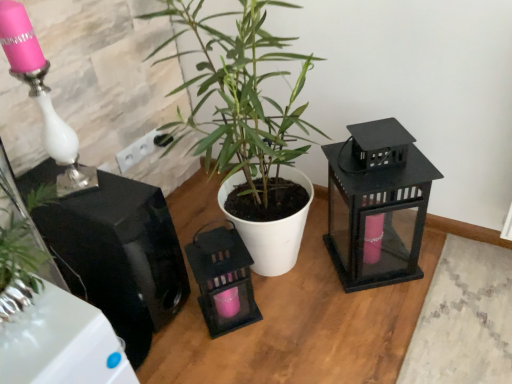
Question: Is glossy black speaker at left, which is the 1th appliance in left-to-right order, aimed at matte black lantern at right, acting as the 2th appliance starting from the left?

Choices:
 (A) no
 (B) yes

Answer: (A)

Question: Does glossy black speaker at left, which ranks as the 2th appliance in right-to-left order, contain matte black lantern at right, acting as the 2th appliance starting from the left?

Choices:
 (A) no
 (B) yes

Answer: (A)

Question: Is glossy black speaker at left, which ranks as the 2th appliance in right-to-left order, outside of matte black lantern at right, acting as the 2th appliance starting from the left?

Choices:
 (A) yes
 (B) no

Answer: (A)

Question: Is glossy black speaker at left, which is the 1th appliance in left-to-right order, placed right next to matte black lantern at right, acting as the 2th appliance starting from the left?

Choices:
 (A) no
 (B) yes

Answer: (A)

Question: Is glossy black speaker at left, which ranks as the 2th appliance in right-to-left order, in front of matte black lantern at right, acting as the 2th appliance starting from the left?

Choices:
 (A) yes
 (B) no

Answer: (A)

Question: Is pink glass table lamp at left wider or thinner than glossy black speaker at left, which is the 1th appliance in left-to-right order?

Choices:
 (A) wide
 (B) thin

Answer: (B)

Question: From a real-world perspective, relative to glossy black speaker at left, which is the 1th appliance in left-to-right order, is pink glass table lamp at left vertically above or below?

Choices:
 (A) above
 (B) below

Answer: (A)

Question: From the image's perspective, relative to glossy black speaker at left, which is the 1th appliance in left-to-right order, is pink glass table lamp at left above or below?

Choices:
 (A) above
 (B) below

Answer: (A)

Question: Is pink glass table lamp at left inside or outside of glossy black speaker at left, which is the 1th appliance in left-to-right order?

Choices:
 (A) inside
 (B) outside

Answer: (B)

Question: From the image's perspective, is pink glass table lamp at left above or below green matte plant at center?

Choices:
 (A) above
 (B) below

Answer: (A)

Question: Considering the positions of point (33, 43) and point (231, 135), is point (33, 43) closer or farther from the camera than point (231, 135)?

Choices:
 (A) farther
 (B) closer

Answer: (B)

Question: Based on their sizes in the image, would you say pink glass table lamp at left is bigger or smaller than green matte plant at center?

Choices:
 (A) big
 (B) small

Answer: (B)

Question: From a real-world perspective, is pink glass table lamp at left above or below green matte plant at center?

Choices:
 (A) below
 (B) above

Answer: (B)

Question: Is glossy black speaker at left, which is the 1th appliance in left-to-right order, bigger or smaller than matte black lantern at right, acting as the 2th appliance starting from the left?

Choices:
 (A) big
 (B) small

Answer: (A)

Question: Considering the positions of glossy black speaker at left, which ranks as the 2th appliance in right-to-left order, and matte black lantern at right, acting as the 2th appliance starting from the left, in the image, is glossy black speaker at left, which ranks as the 2th appliance in right-to-left order, taller or shorter than matte black lantern at right, acting as the 2th appliance starting from the left,?

Choices:
 (A) tall
 (B) short

Answer: (B)